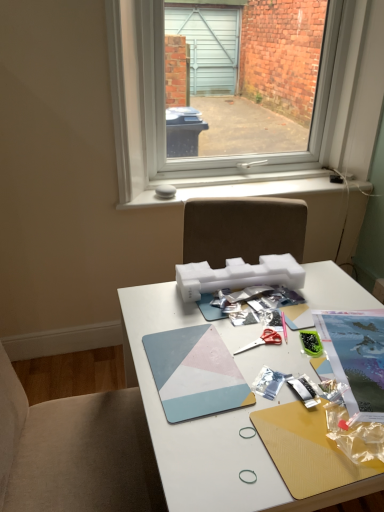
Where is `vacant space to the left of green plastic container at center-right`? vacant space to the left of green plastic container at center-right is located at coordinates (240, 346).